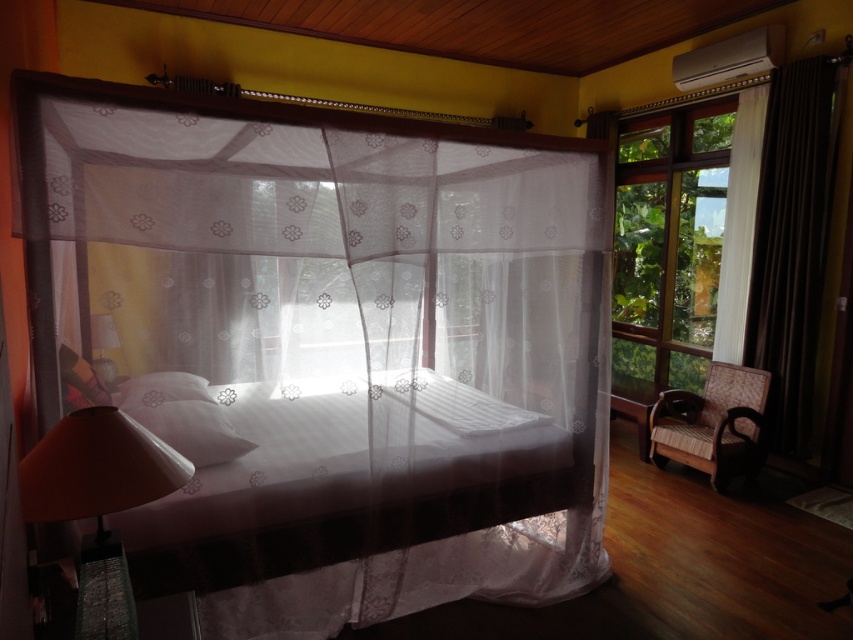
Question: Which point appears closest to the camera in this image?

Choices:
 (A) (815, 88)
 (B) (207, 433)
 (C) (727, 256)
 (D) (44, 502)

Answer: (D)

Question: Can you confirm if white sheer mosquito net at center is positioned above brown velvet curtain at right?

Choices:
 (A) no
 (B) yes

Answer: (A)

Question: Is white sheer mosquito net at center wider than white soft pillow at center?

Choices:
 (A) yes
 (B) no

Answer: (A)

Question: Which of these objects is positioned closest to the white sheer curtain at right?

Choices:
 (A) orange fabric lampshade at lower left
 (B) brown velvet curtain at right

Answer: (B)

Question: Is orange fabric lampshade at lower left positioned before white soft pillow at center?

Choices:
 (A) no
 (B) yes

Answer: (B)

Question: Which point is closer to the camera?

Choices:
 (A) (187, 424)
 (B) (747, 284)

Answer: (A)